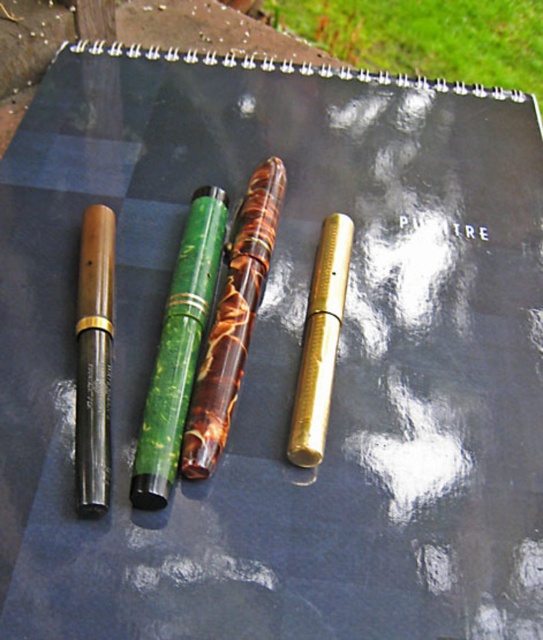
Question: Among these points, which one is nearest to the camera?

Choices:
 (A) (86, 328)
 (B) (269, 248)

Answer: (A)

Question: Estimate the real-world distances between objects in this image. Which object is closer to the wooden pen at left?

Choices:
 (A) green marble pen at center
 (B) marbled brown pen at center

Answer: (A)

Question: Does green marble pen at center appear over marbled brown pen at center?

Choices:
 (A) yes
 (B) no

Answer: (B)

Question: Considering the relative positions of green marble pen at center and marbled brown pen at center in the image provided, where is green marble pen at center located with respect to marbled brown pen at center?

Choices:
 (A) above
 (B) below

Answer: (B)

Question: Which object is the closest to the marbled brown pen at center?

Choices:
 (A) green marble pen at center
 (B) wooden pen at left

Answer: (A)

Question: Can you confirm if green marble pen at center is wider than marbled brown pen at center?

Choices:
 (A) no
 (B) yes

Answer: (A)